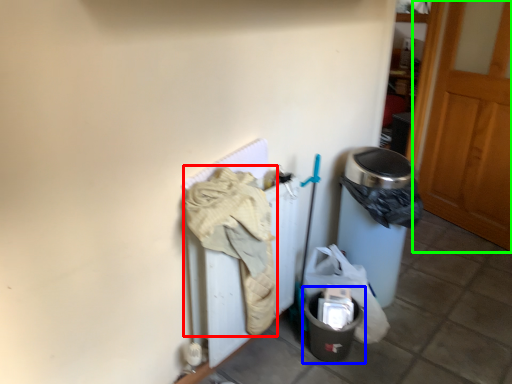
Question: Which object is the closest to the clothing (highlighted by a red box)? Choose among these: recycling bin (highlighted by a blue box) or door (highlighted by a green box).

Choices:
 (A) recycling bin
 (B) door

Answer: (A)